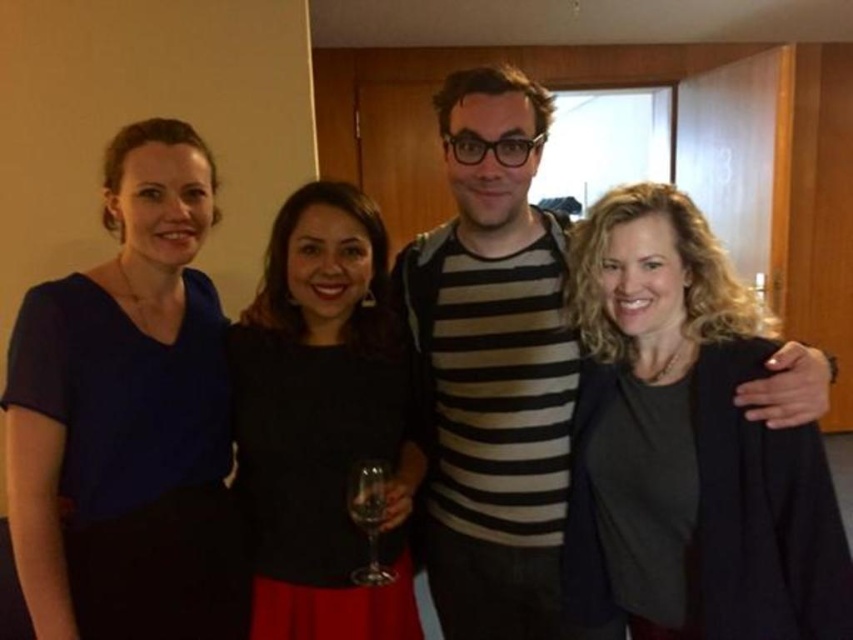
You are a photographer at the event and want to capture a shot where the black matte dress at center is to the left of the transparent glass wine glass at center. Does the current arrangement allow this?

Yes, the current arrangement allows the black matte dress at center to be to the left of the transparent glass wine glass at center because the black matte dress at center is positioned on the left side of the transparent glass wine glass at center.

You are planning to place a decorative item on a table that can only hold items smaller than the black matte dress at center. Can the transparent glass at center be placed there?

The transparent glass at center is smaller than the black matte dress at center, so yes, it can be placed on the table.

You are organizing a charity event and need to display two outfits on mannequins. The striped cotton shirt at center and the black matte dress at center must be placed side by side. Given their sizes, which outfit will require a larger display space?

The striped cotton shirt at center has a larger size compared to the black matte dress at center, so it will require a larger display space.